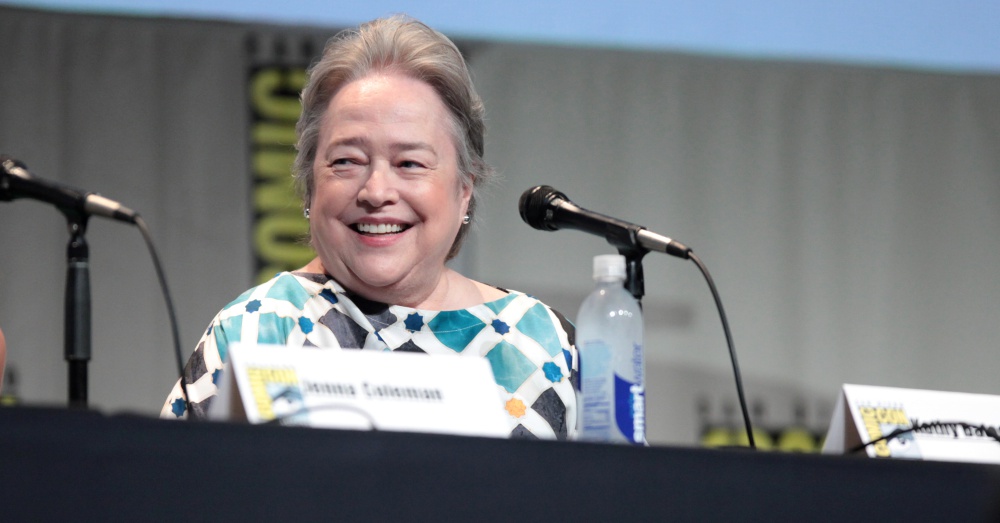
Find the location of `table`. table is located at coordinates coord(535,483).